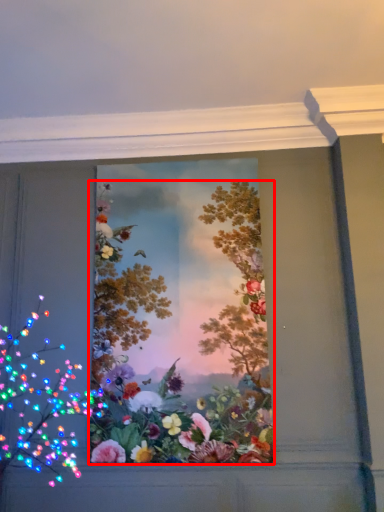
Question: From the image's perspective, where is flower (annotated by the red box) located in relation to flower in the image?

Choices:
 (A) below
 (B) above

Answer: (B)